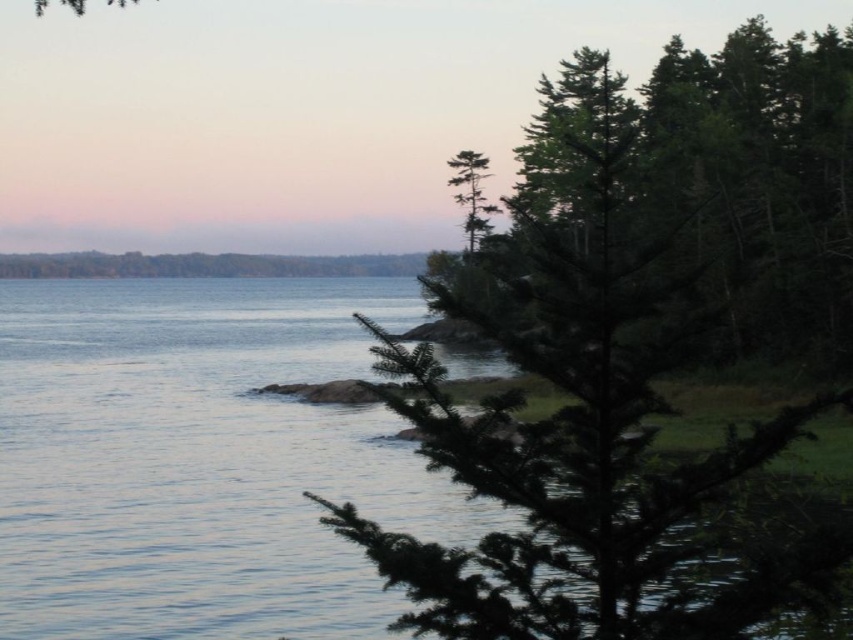
Which is more to the left, green needle-like tree at center or green needle-like tree at upper center?

From the viewer's perspective, green needle-like tree at upper center appears more on the left side.

Can you confirm if green needle-like tree at center is bigger than green needle-like tree at upper center?

Yes, green needle-like tree at center is bigger than green needle-like tree at upper center.

Locate an element on the screen. green needle-like tree at center is located at coordinates (592, 406).

Can you confirm if clear water at center is shorter than green needle-like tree at upper center?

Incorrect, clear water at center's height does not fall short of green needle-like tree at upper center's.

Can you confirm if clear water at center is wider than green needle-like tree at upper center?

Correct, the width of clear water at center exceeds that of green needle-like tree at upper center.

Between point (473, 524) and point (469, 250), which one is positioned in front?

Point (473, 524) is more forward.

What are the coordinates of `clear water at center` in the screenshot? It's located at (202, 460).

Consider the image. How much distance is there between green needle-like tree at center and clear water at center?

green needle-like tree at center is 23.56 meters away from clear water at center.

Does green needle-like tree at center have a lesser width compared to clear water at center?

Indeed, green needle-like tree at center has a lesser width compared to clear water at center.

Does point (666, 474) come farther from viewer compared to point (444, 497)?

No, (666, 474) is closer to viewer.

Identify the location of green needle-like tree at center. This screenshot has width=853, height=640. 592,406.